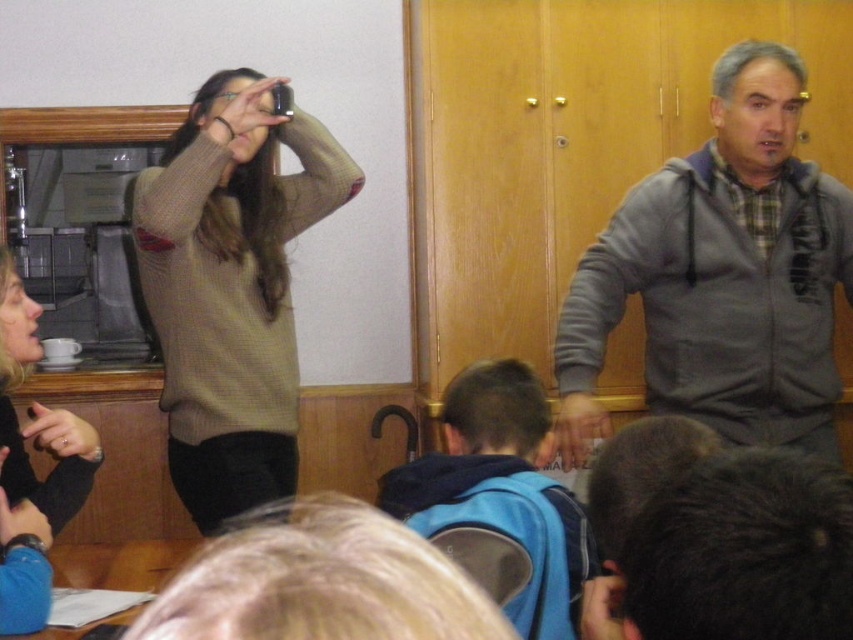
Which of these two, blue backpack at center or matte gray hand at lower center, stands taller?

Standing taller between the two is blue backpack at center.

Who is higher up, blue backpack at center or matte gray hand at lower center?

matte gray hand at lower center is higher up.

Is point (482, 525) less distant than point (560, 456)?

Yes, point (482, 525) is in front of point (560, 456).

This screenshot has height=640, width=853. Identify the location of blue backpack at center. (500, 500).

Which of these two, matte gray hand at lower center or gold ring at lower left, stands shorter?

Standing shorter between the two is gold ring at lower left.

Is point (583, 392) positioned in front of point (51, 420)?

No, it is not.

The image size is (853, 640). What are the coordinates of `matte gray hand at lower center` in the screenshot? It's located at (578, 428).

Based on the photo, between matte black camera at upper left and gold ring at lower left, which one has less height?

With less height is gold ring at lower left.

Who is positioned more to the right, matte black camera at upper left or gold ring at lower left?

matte black camera at upper left is more to the right.

Is point (253, 141) more distant than point (57, 422)?

Yes, it is.

Find the location of a particular element. matte black camera at upper left is located at coordinates (242, 116).